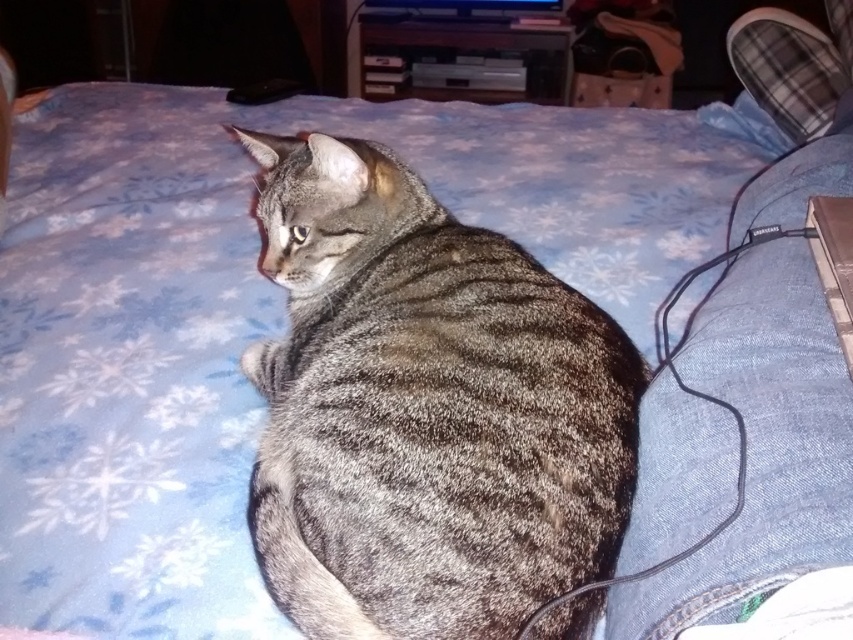
Is gray striped fur cat at center shorter than black matte laptop at upper right?

No.

Is gray striped fur cat at center further to the viewer compared to black matte laptop at upper right?

No, gray striped fur cat at center is closer to the viewer.

Is point (294, 465) less distant than point (820, 275)?

Yes, point (294, 465) is closer to viewer.

You are a GUI agent. You are given a task and a screenshot of the screen. Output one action in this format:
    pyautogui.click(x=<x>, y=<y>)
    Task: Click on the gray striped fur cat at center
    The width and height of the screenshot is (853, 640).
    Given the screenshot: What is the action you would take?
    pyautogui.click(x=425, y=408)

Which is below, gray striped fur cat at center or denim at lower right?

gray striped fur cat at center is lower down.

Based on the photo, between gray striped fur cat at center and denim at lower right, which one is positioned higher?

denim at lower right

Who is more distant from viewer, [412,324] or [706,547]?

The point [412,324] is behind.

Where is `gray striped fur cat at center`? gray striped fur cat at center is located at coordinates coord(425,408).

Which is below, denim at lower right or black matte laptop at upper right?

Positioned lower is black matte laptop at upper right.

Is denim at lower right shorter than black matte laptop at upper right?

In fact, denim at lower right may be taller than black matte laptop at upper right.

What are the coordinates of `denim at lower right` in the screenshot? It's located at (761, 445).